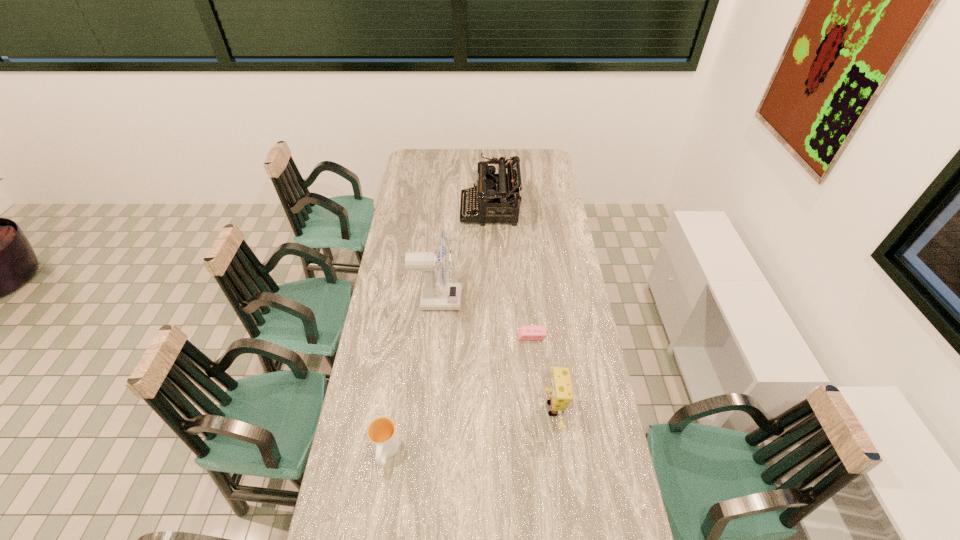
Locate an element on the screen. This screenshot has width=960, height=540. fan is located at coordinates (434, 296).

You are a GUI agent. You are given a task and a screenshot of the screen. Output one action in this format:
    pyautogui.click(x=<x>, y=<y>)
    Task: Click on the tallest object
    
    Given the screenshot: What is the action you would take?
    click(434, 296)

Find the location of a particular element. This screenshot has height=540, width=960. the second tallest object is located at coordinates click(496, 195).

The image size is (960, 540). Identify the location of typewriter. [496, 195].

At what (x,y) coordinates should I click in order to perform the action: click on the third tallest object. Please return your answer as a coordinate pair (x, y). The width and height of the screenshot is (960, 540). Looking at the image, I should click on (561, 393).

Locate an element on the screen. the fourth tallest object is located at coordinates (382, 433).

Where is `the shortest object`? This screenshot has height=540, width=960. the shortest object is located at coordinates (524, 332).

Locate an element on the screen. The image size is (960, 540). eraser is located at coordinates (524, 332).

At what (x,y) coordinates should I click in order to perform the action: click on free space located on the front-facing side of the second farthest object. Please return your answer as a coordinate pair (x, y). Looking at the image, I should click on (549, 300).

I want to click on free space located 0.300m on the keyboard of the second tallest object, so click(400, 210).